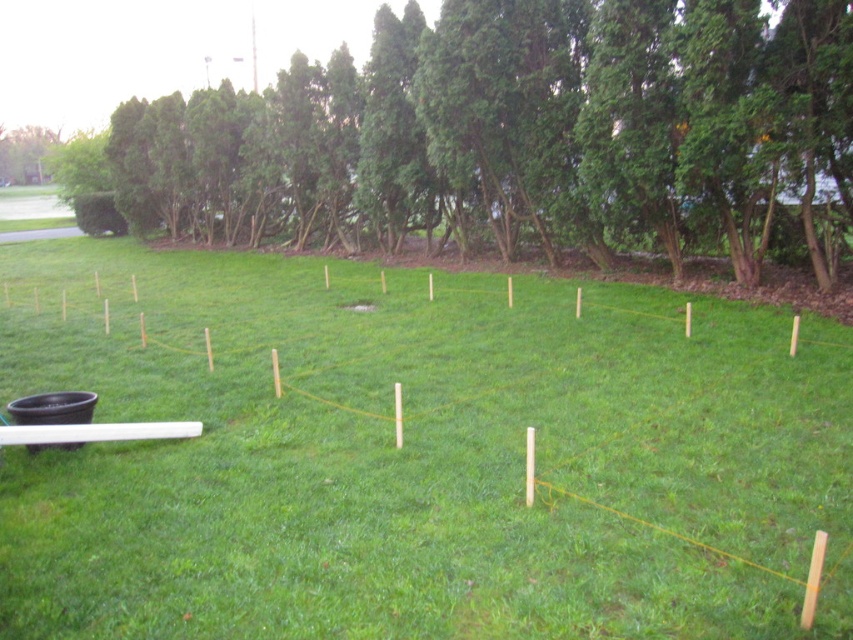
Can you confirm if green grass at center is wider than green leafy tree at upper left?

Indeed, green grass at center has a greater width compared to green leafy tree at upper left.

Who is shorter, green grass at center or green leafy tree at upper left?

Standing shorter between the two is green grass at center.

Locate an element on the screen. This screenshot has height=640, width=853. green grass at center is located at coordinates click(x=415, y=456).

Between green leafy tree at upper center and green leafy tree at upper left, which one is positioned lower?

green leafy tree at upper center

Can you confirm if green leafy tree at upper center is wider than green leafy tree at upper left?

Correct, the width of green leafy tree at upper center exceeds that of green leafy tree at upper left.

Is point (334, 198) behind point (39, 150)?

No, (334, 198) is closer to viewer.

Locate an element on the screen. Image resolution: width=853 pixels, height=640 pixels. green leafy tree at upper center is located at coordinates (509, 132).

Find the location of a particular element. The width and height of the screenshot is (853, 640). green grass at center is located at coordinates (415, 456).

Which of these two, green grass at center or green leafy tree at upper center, stands shorter?

Standing shorter between the two is green grass at center.

This screenshot has width=853, height=640. Identify the location of green grass at center. (415, 456).